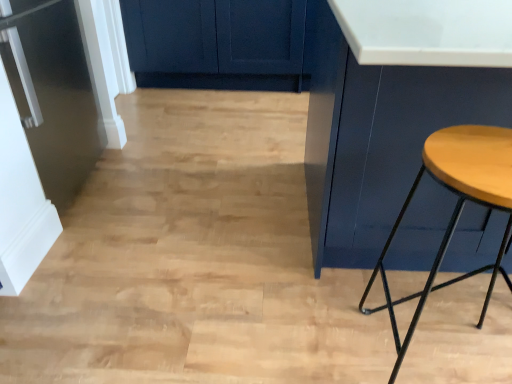
What do you see at coordinates (41, 129) in the screenshot? I see `satin black refrigerator at left` at bounding box center [41, 129].

The image size is (512, 384). Find the location of `matte blue cabinet at right`. matte blue cabinet at right is located at coordinates (392, 107).

Where is `wooden stool at right`? wooden stool at right is located at coordinates (456, 207).

Is matte blue cabinet at right located within wooden stool at right?

Definitely not — matte blue cabinet at right is not inside wooden stool at right.

Is wooden stool at right directly adjacent to matte blue cabinet at right?

No, wooden stool at right is not making contact with matte blue cabinet at right.

From a real-world perspective, is wooden stool at right on matte blue cabinet at right?

No, from a real-world perspective, wooden stool at right is not on top of matte blue cabinet at right.

In the scene shown: Can you confirm if wooden stool at right is wider than matte blue cabinet at right?

In fact, wooden stool at right might be narrower than matte blue cabinet at right.

Is matte blue cabinet at right touching satin black refrigerator at left?

No, matte blue cabinet at right is not next to satin black refrigerator at left.

From the picture: Is matte blue cabinet at right wider than satin black refrigerator at left?

Correct, the width of matte blue cabinet at right exceeds that of satin black refrigerator at left.

Consider the image. How many degrees apart are the facing directions of matte blue cabinet at right and satin black refrigerator at left?

They differ by 89.4 degrees in their facing directions.

Image resolution: width=512 pixels, height=384 pixels. I want to click on fridge below the matte blue cabinet at right (from a real-world perspective), so click(x=41, y=129).

In the scene shown: Is satin black refrigerator at left spatially inside wooden stool at right, or outside of it?

satin black refrigerator at left cannot be found inside wooden stool at right.

Measure the distance from satin black refrigerator at left to wooden stool at right.

satin black refrigerator at left is 1.36 meters from wooden stool at right.

Identify the location of stool located below the satin black refrigerator at left (from the image's perspective). pyautogui.click(x=456, y=207).

Who is smaller, satin black refrigerator at left or wooden stool at right?

With smaller size is wooden stool at right.

Is wooden stool at right facing towards satin black refrigerator at left?

No, wooden stool at right is not oriented towards satin black refrigerator at left.

Considering the positions of objects wooden stool at right and satin black refrigerator at left in the image provided, who is behind, wooden stool at right or satin black refrigerator at left?

Positioned behind is satin black refrigerator at left.

Would you consider wooden stool at right to be distant from satin black refrigerator at left?

wooden stool at right is positioned a significant distance from satin black refrigerator at left.

Does wooden stool at right have a lesser height compared to satin black refrigerator at left?

Yes, wooden stool at right is shorter than satin black refrigerator at left.

Is satin black refrigerator at left located outside matte blue cabinet at right?

That's correct, satin black refrigerator at left is outside of matte blue cabinet at right.

Does satin black refrigerator at left have a lesser width compared to matte blue cabinet at right?

Indeed, satin black refrigerator at left has a lesser width compared to matte blue cabinet at right.

Who is bigger, satin black refrigerator at left or matte blue cabinet at right?

matte blue cabinet at right is bigger.

Considering the sizes of objects matte blue cabinet at right and wooden stool at right in the image provided, who is smaller, matte blue cabinet at right or wooden stool at right?

wooden stool at right.

Is matte blue cabinet at right looking in the opposite direction of wooden stool at right?

No.

Identify the location of cabinetry that is on the right side of wooden stool at right. This screenshot has height=384, width=512. (392, 107).

Measure the distance from matte blue cabinet at right to wooden stool at right.

The distance of matte blue cabinet at right from wooden stool at right is 10.57 inches.

Where is `cabinetry that is above the wooden stool at right (from the image's perspective)`? The image size is (512, 384). cabinetry that is above the wooden stool at right (from the image's perspective) is located at coordinates (392, 107).

This screenshot has height=384, width=512. I want to click on cabinetry in front of the satin black refrigerator at left, so click(x=392, y=107).

Based on their spatial positions, is wooden stool at right or matte blue cabinet at right closer to satin black refrigerator at left?

Among the two, matte blue cabinet at right is located nearer to satin black refrigerator at left.

Looking at the image, which one is located closer to wooden stool at right, satin black refrigerator at left or matte blue cabinet at right?

The object closer to wooden stool at right is matte blue cabinet at right.

Looking at the image, which one is located further to matte blue cabinet at right, satin black refrigerator at left or wooden stool at right?

Based on the image, satin black refrigerator at left appears to be further to matte blue cabinet at right.

From the image, which object appears to be nearer to wooden stool at right, matte blue cabinet at right or satin black refrigerator at left?

Among the two, matte blue cabinet at right is located nearer to wooden stool at right.

Looking at the image, which one is located closer to matte blue cabinet at right, wooden stool at right or satin black refrigerator at left?

wooden stool at right lies closer to matte blue cabinet at right than the other object.

Which object lies further to the anchor point satin black refrigerator at left, matte blue cabinet at right or wooden stool at right?

The object further to satin black refrigerator at left is wooden stool at right.

Locate an element on the screen. The height and width of the screenshot is (384, 512). stool between satin black refrigerator at left and matte blue cabinet at right in the horizontal direction is located at coordinates (456, 207).